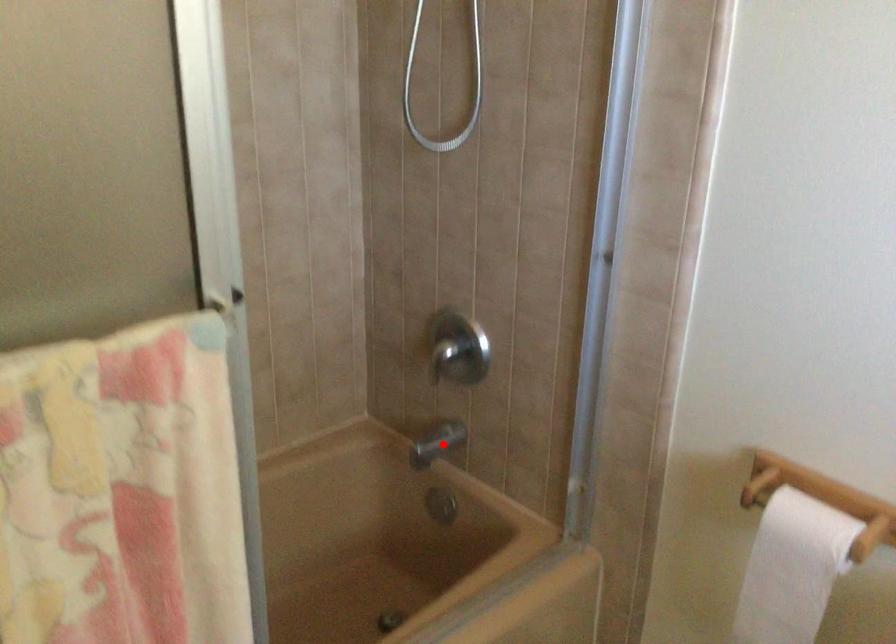
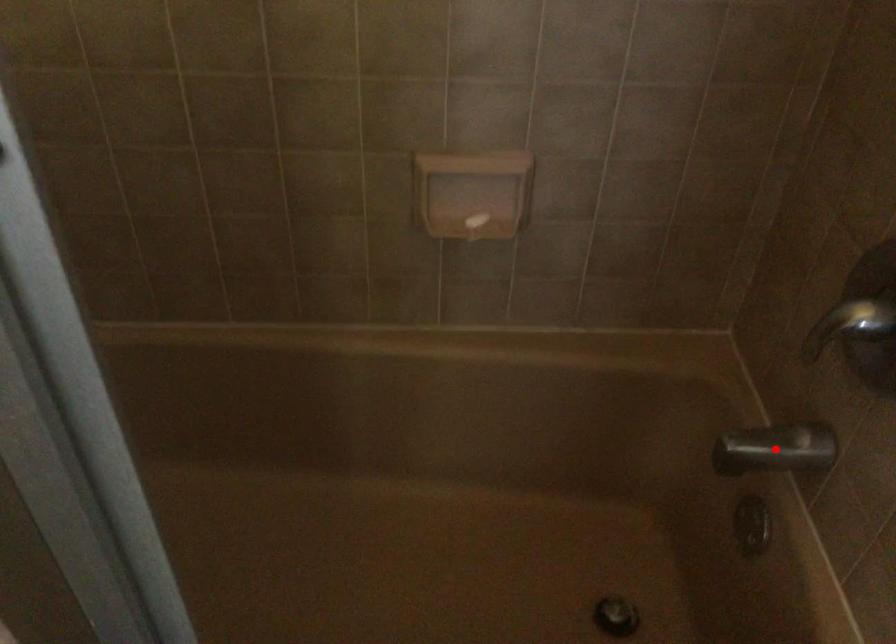
I am providing you with two images of the same scene from different viewpoints. A red point is marked on the first image and another point is marked on the second image. Is the red point in image1 aligned with the point shown in image2?

Yes